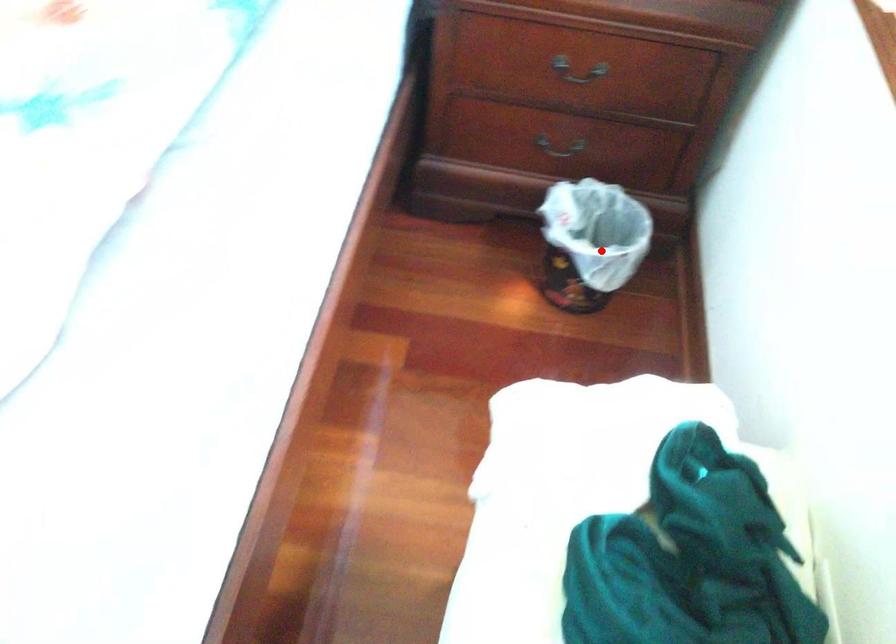
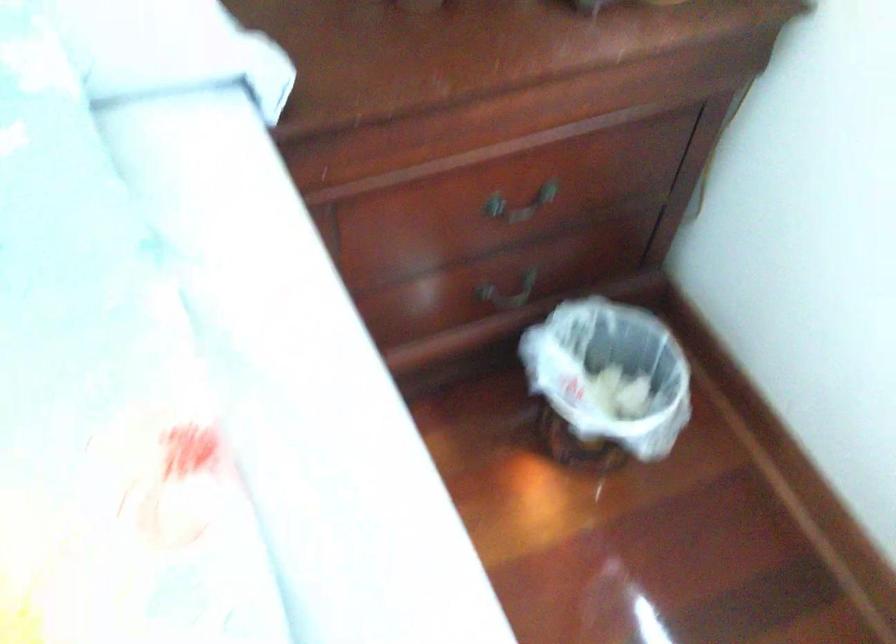
Question: I am providing you with two images of the same scene from different viewpoints. A red point is shown in image1. For the corresponding object point in image2, is it positioned nearer or farther from the camera?

Choices:
 (A) Nearer
 (B) Farther

Answer: (A)